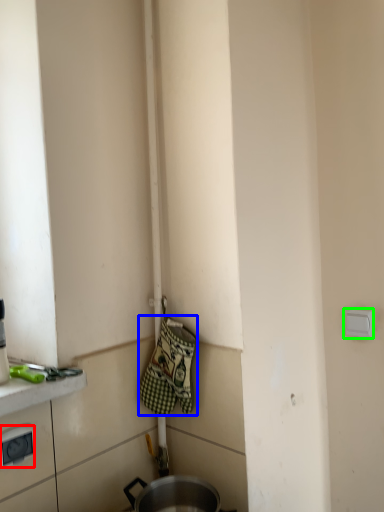
Question: Estimate the real-world distances between objects in this image. Which object is closer to electric outlet (highlighted by a red box), blanket (highlighted by a blue box) or electric outlet (highlighted by a green box)?

Choices:
 (A) blanket
 (B) electric outlet

Answer: (A)